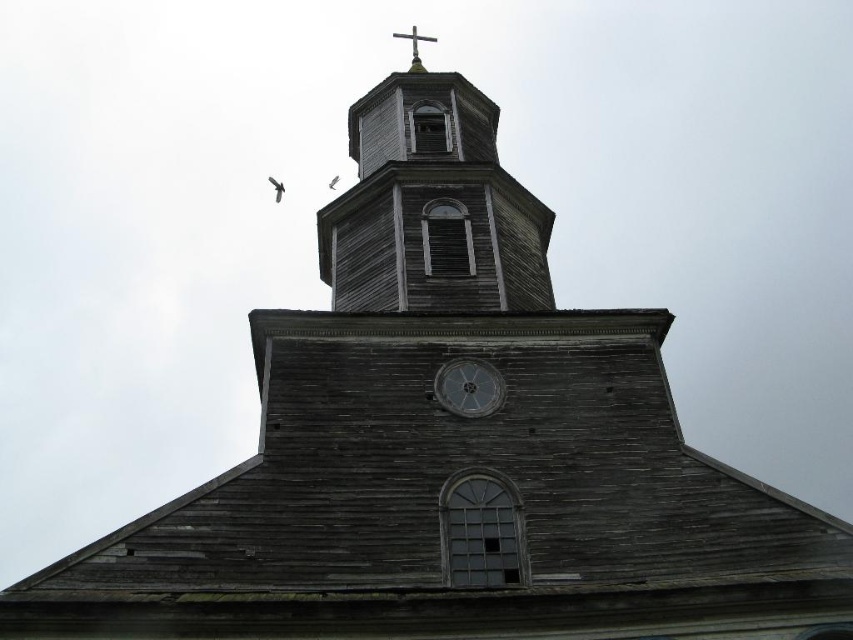
Question: Considering the real-world distances, which object is farthest from the metallic cross at top?

Choices:
 (A) metallic gray clock at center
 (B) weathered wood clock tower at upper center

Answer: (A)

Question: Which is nearer to the weathered wood clock tower at upper center?

Choices:
 (A) metallic cross at top
 (B) metallic gray clock at center

Answer: (B)

Question: Which of the following is the closest to the observer?

Choices:
 (A) metallic cross at top
 (B) weathered wood clock tower at upper center

Answer: (B)

Question: Can you confirm if weathered wood clock tower at upper center is smaller than metallic gray clock at center?

Choices:
 (A) no
 (B) yes

Answer: (A)

Question: Is metallic gray clock at center positioned behind metallic cross at top?

Choices:
 (A) no
 (B) yes

Answer: (A)

Question: Does weathered wood clock tower at upper center appear on the right side of metallic gray clock at center?

Choices:
 (A) yes
 (B) no

Answer: (B)